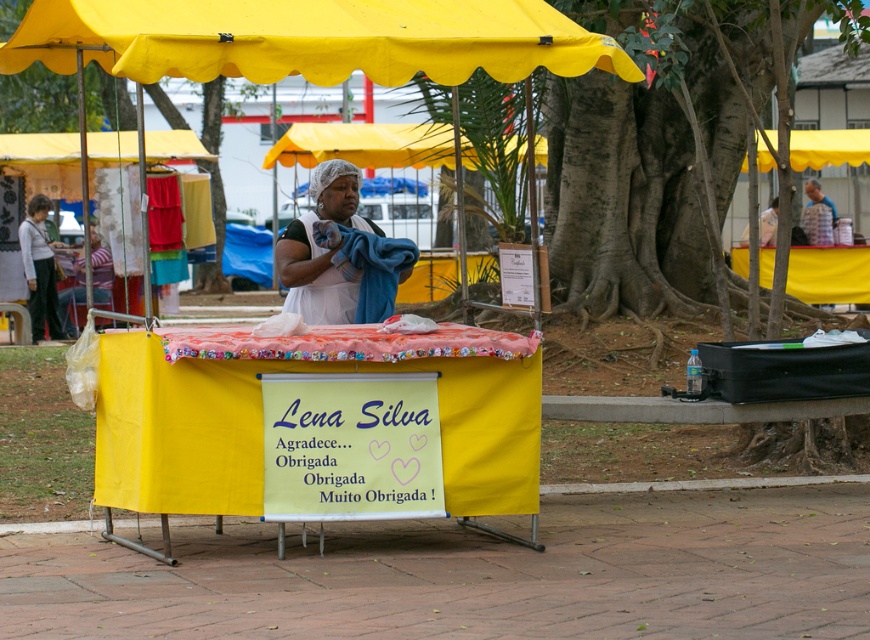
You are a customer at the outdoor market and want to know which of the two points, point (390, 17) or point (352, 237), is closer to you. Can you determine this based on your position?

Point (390, 17) is closer to the viewer than point (352, 237), so the first point is closer to you.

You are a customer at the outdoor market and want to locate the vendor stall with the yellow fabric canopy at upper center and the yellow fabric canopy at upper left. Which one is positioned to the right of the other?

The yellow fabric canopy at upper center is positioned on the right side of yellow fabric canopy at upper left.

You are a customer at the market and want to know which fabric is wider between the yellow fabric canopy at upper center and the white fabric at center. Which one is wider?

The yellow fabric canopy at upper center is wider than the white fabric at center.